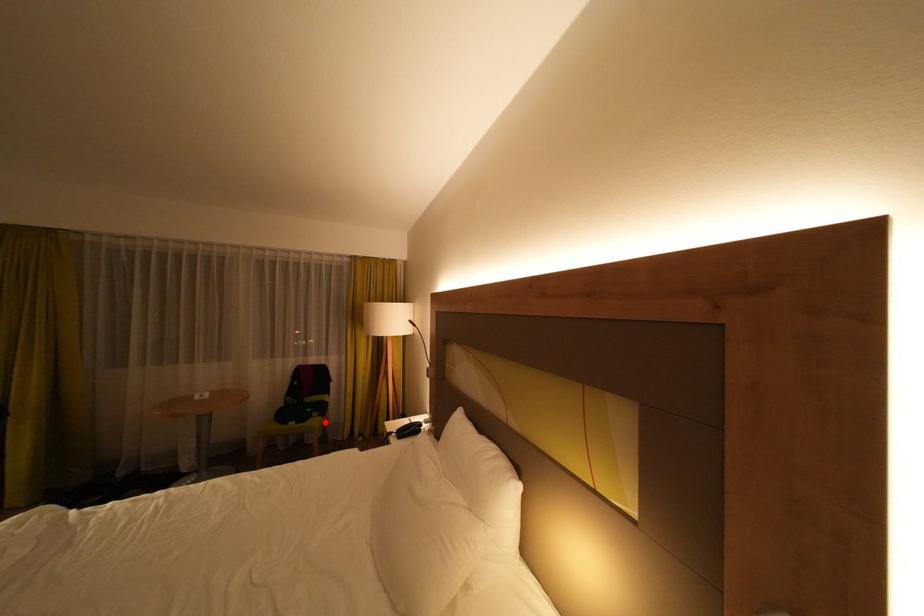
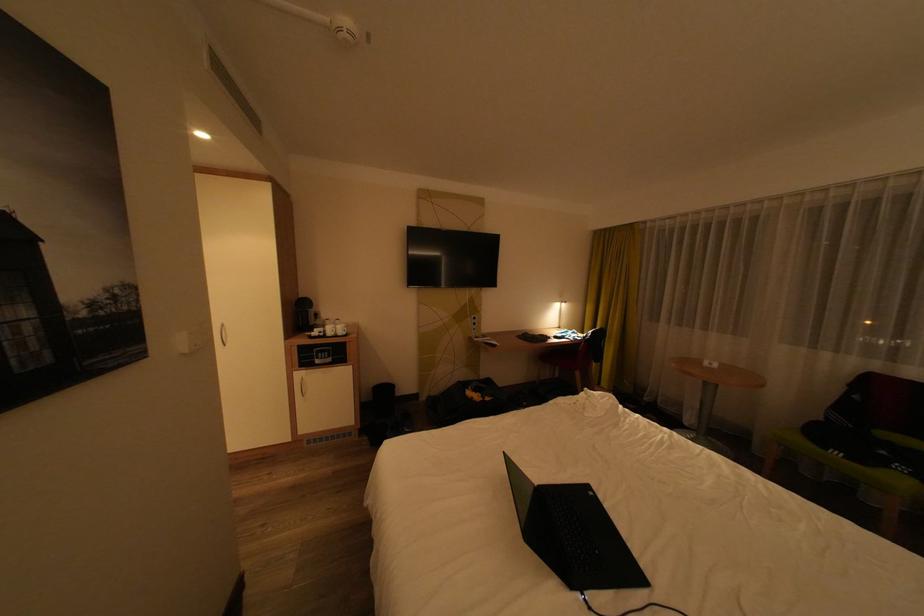
Locate, in the second image, the point that corresponds to the highlighted location in the first image.

(906, 480)